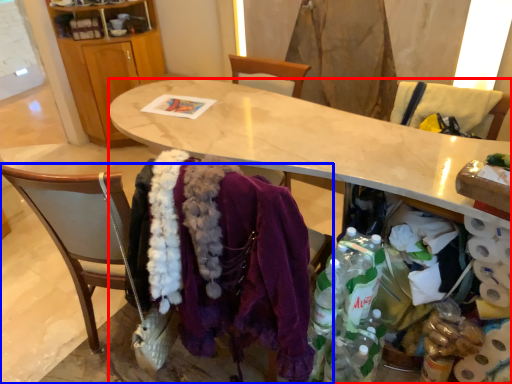
Question: Which object is closer to the camera taking this photo, desk (highlighted by a red box) or chair (highlighted by a blue box)?

Choices:
 (A) desk
 (B) chair

Answer: (B)